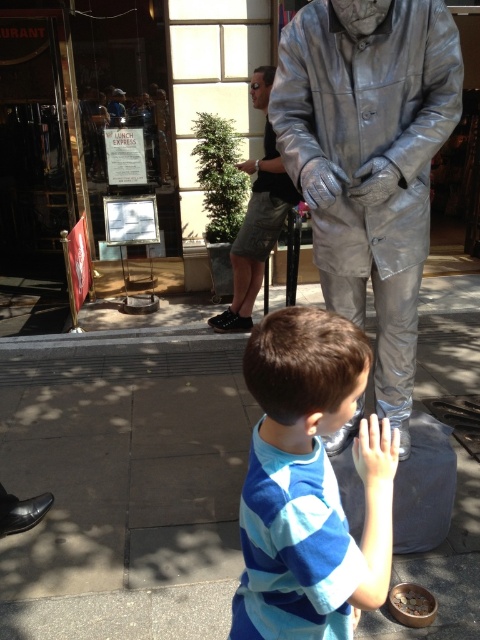
Which is more to the right, gray concrete sidewalk at center or matte silver hand at lower center?

matte silver hand at lower center

What do you see at coordinates (124, 493) in the screenshot? I see `gray concrete sidewalk at center` at bounding box center [124, 493].

You are a GUI agent. You are given a task and a screenshot of the screen. Output one action in this format:
    pyautogui.click(x=<x>, y=<y>)
    Task: Click on the gray concrete sidewalk at center
    
    Given the screenshot: What is the action you would take?
    pyautogui.click(x=124, y=493)

Which of these two, gray concrete sidewalk at center or blue striped shirt at center, stands taller?

Standing taller between the two is gray concrete sidewalk at center.

Does gray concrete sidewalk at center appear on the right side of blue striped shirt at center?

In fact, gray concrete sidewalk at center is to the left of blue striped shirt at center.

Is point (152, 621) positioned before point (344, 372)?

No, (152, 621) is behind (344, 372).

Locate an element on the screen. gray concrete sidewalk at center is located at coordinates (124, 493).

Image resolution: width=480 pixels, height=640 pixels. Describe the element at coordinates (370, 157) in the screenshot. I see `shiny metallic suit at center` at that location.

Does shiny metallic suit at center come in front of matte silver hand at lower center?

No, shiny metallic suit at center is further to the viewer.

Between point (407, 182) and point (376, 448), which one is positioned behind?

Point (407, 182)

The height and width of the screenshot is (640, 480). What are the coordinates of `shiny metallic suit at center` in the screenshot? It's located at (370, 157).